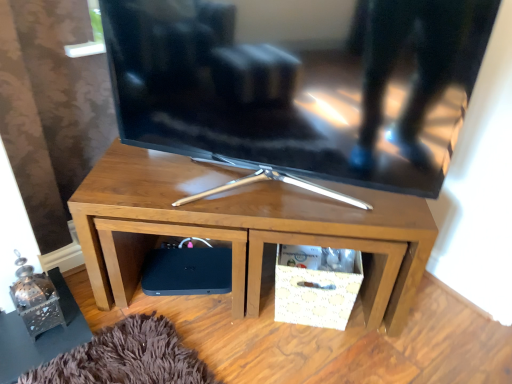
Question: Considering the relative sizes of matte black tv at center and wooden tv stand at center in the image provided, is matte black tv at center wider than wooden tv stand at center?

Choices:
 (A) no
 (B) yes

Answer: (A)

Question: Does matte black tv at center turn towards wooden tv stand at center?

Choices:
 (A) no
 (B) yes

Answer: (A)

Question: Is the position of matte black tv at center more distant than that of wooden tv stand at center?

Choices:
 (A) yes
 (B) no

Answer: (B)

Question: From the image's perspective, is matte black tv at center on top of wooden tv stand at center?

Choices:
 (A) yes
 (B) no

Answer: (A)

Question: Are matte black tv at center and wooden tv stand at center making contact?

Choices:
 (A) no
 (B) yes

Answer: (A)

Question: Considering the relative sizes of matte black tv at center and wooden tv stand at center in the image provided, is matte black tv at center shorter than wooden tv stand at center?

Choices:
 (A) no
 (B) yes

Answer: (A)

Question: Does black matte speaker at lower left have a greater height compared to wooden tv stand at center?

Choices:
 (A) no
 (B) yes

Answer: (A)

Question: Is black matte speaker at lower left oriented away from wooden tv stand at center?

Choices:
 (A) no
 (B) yes

Answer: (B)

Question: From the image's perspective, is black matte speaker at lower left above wooden tv stand at center?

Choices:
 (A) yes
 (B) no

Answer: (B)

Question: From a real-world perspective, is black matte speaker at lower left positioned over wooden tv stand at center based on gravity?

Choices:
 (A) yes
 (B) no

Answer: (B)

Question: Is wooden tv stand at center a part of black matte speaker at lower left?

Choices:
 (A) no
 (B) yes

Answer: (A)

Question: From the image's perspective, does black matte speaker at lower left appear lower than wooden tv stand at center?

Choices:
 (A) yes
 (B) no

Answer: (A)

Question: Considering the relative positions of black matte speaker at lower left and matte black tv at center in the image provided, is black matte speaker at lower left behind matte black tv at center?

Choices:
 (A) yes
 (B) no

Answer: (A)